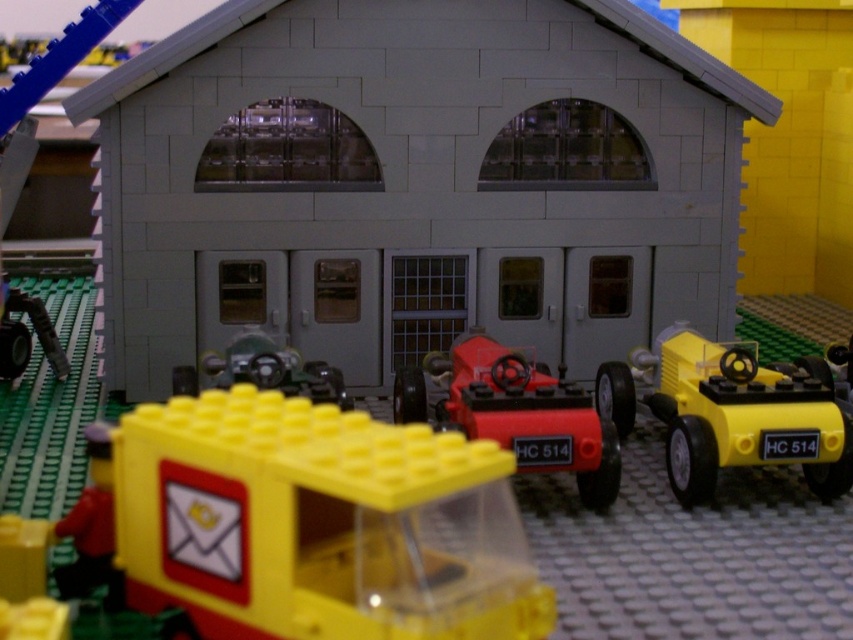
Question: Is translucent yellow truck at center closer to the viewer compared to metallic green car at center?

Choices:
 (A) no
 (B) yes

Answer: (B)

Question: Is shiny red car at center above metallic green car at center?

Choices:
 (A) yes
 (B) no

Answer: (B)

Question: Does yellow plastic car at right have a smaller size compared to metallic green car at center?

Choices:
 (A) yes
 (B) no

Answer: (B)

Question: Which of these objects is positioned closest to the yellow plastic car at right?

Choices:
 (A) metallic green car at center
 (B) translucent yellow truck at center

Answer: (B)

Question: Among these objects, which one is nearest to the camera?

Choices:
 (A) yellow plastic car at right
 (B) metallic green car at center
 (C) shiny red car at center
 (D) translucent yellow truck at center

Answer: (D)

Question: Which point appears closest to the camera in this image?

Choices:
 (A) (409, 429)
 (B) (438, 371)
 (C) (801, 465)

Answer: (A)